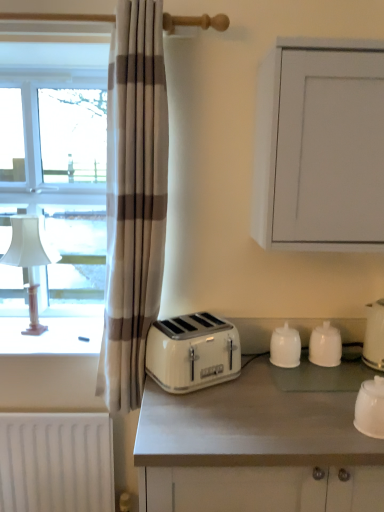
Identify the location of free space to the left of white glossy kettle at right, arranged as the first kitchen appliance when viewed from the right. The height and width of the screenshot is (512, 384). (341, 374).